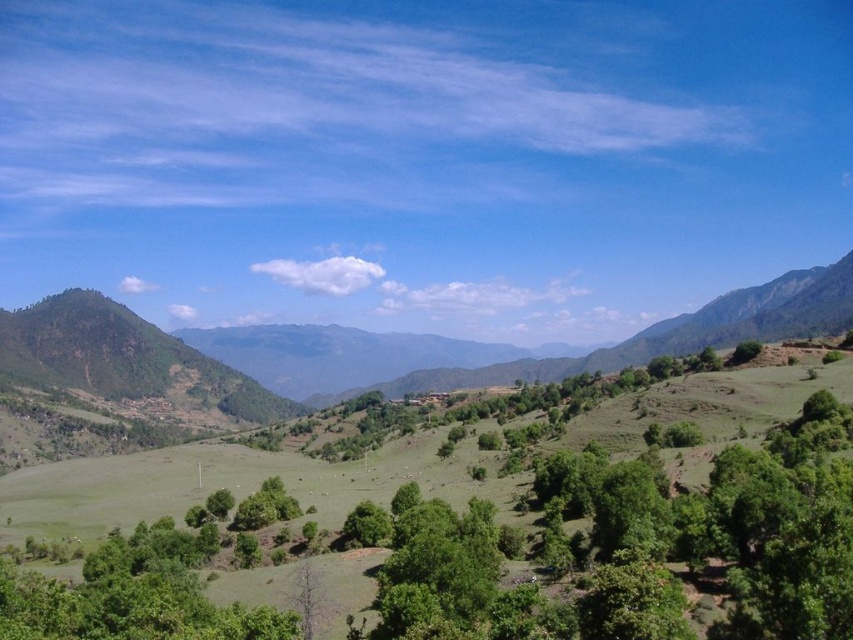
You are planning to set up a picnic area in the image. You have a large blanket that can cover the entire green leafy tree at center. Can you also place another picnic blanket on the green grassy hillside at left without overlapping?

The green grassy hillside at left is larger in size than the green leafy tree at center. Since your blanket can cover the entire tree, there should be enough space on the hillside to place another blanket without overlapping.

You are standing at the base of the green grassy hillside at left and want to reach the green leafy tree at center. Which direction should you move to get closer to the tree?

Since the green grassy hillside at left is taller than the green leafy tree at center, you should move towards the center of the image where the tree is located to get closer to it.

You are standing in the valley and want to walk towards the green leafy tree at center. Which direction should you head to avoid the green grassy hillside at left?

To reach the green leafy tree at center while avoiding the green grassy hillside at left, you should head to the right since the green grassy hillside at left is positioned to the right of the green leafy tree at center.